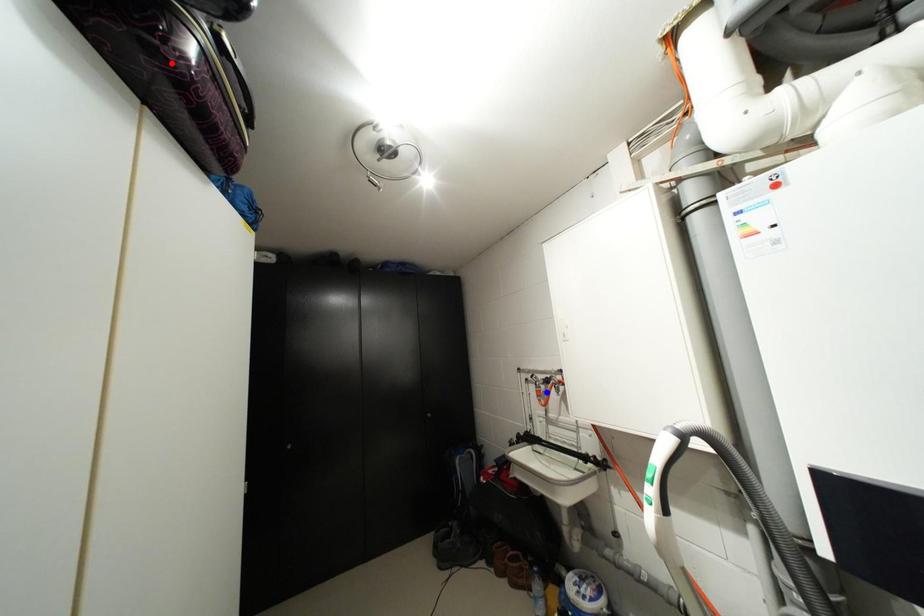
Question: Two points are marked on the image. Which point is closer to the camera?

Choices:
 (A) Blue point is closer.
 (B) Red point is closer.

Answer: (B)